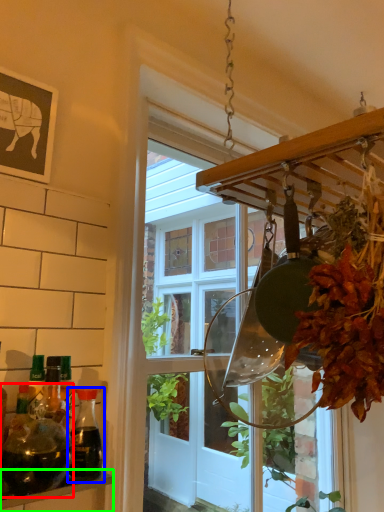
Question: Based on their relative distances, which object is nearer to bottle (highlighted by a red box)? Choose from bottle (highlighted by a blue box) and shelf (highlighted by a green box).

Choices:
 (A) bottle
 (B) shelf

Answer: (A)